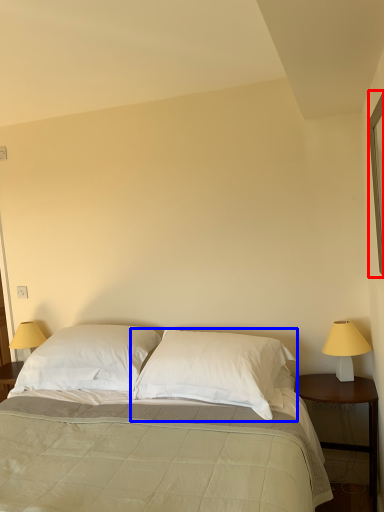
Question: Among these objects, which one is nearest to the camera, window (highlighted by a red box) or pillow (highlighted by a blue box)?

Choices:
 (A) window
 (B) pillow

Answer: (A)